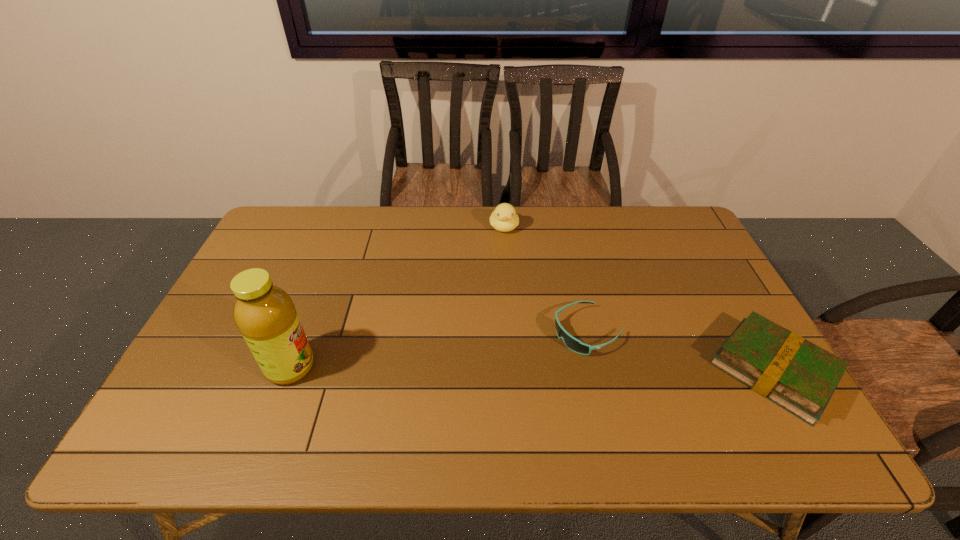
The image size is (960, 540). Find the location of `object situated at the near right corner`. object situated at the near right corner is located at coordinates pyautogui.click(x=799, y=376).

The image size is (960, 540). I want to click on vacant area at the far edge, so click(407, 222).

Find the location of a particular element. The height and width of the screenshot is (540, 960). vacant space at the near edge of the desktop is located at coordinates (435, 408).

This screenshot has height=540, width=960. Find the location of `free point at the left edge`. free point at the left edge is located at coordinates (244, 271).

The image size is (960, 540). Find the location of `vacant space at the right edge of the desktop`. vacant space at the right edge of the desktop is located at coordinates (672, 267).

In the image, there is a desktop. Where is `vacant space at the near left corner`? The height and width of the screenshot is (540, 960). vacant space at the near left corner is located at coordinates (183, 401).

This screenshot has width=960, height=540. I want to click on vacant space at the far right corner of the desktop, so click(692, 227).

Find the location of `vacant region between the fruit juice and the duckling`. vacant region between the fruit juice and the duckling is located at coordinates (397, 297).

I want to click on vacant space that's between the shortest object and the leftmost object, so click(x=440, y=349).

Identify the location of free point between the shortest object and the rightmost object. (681, 351).